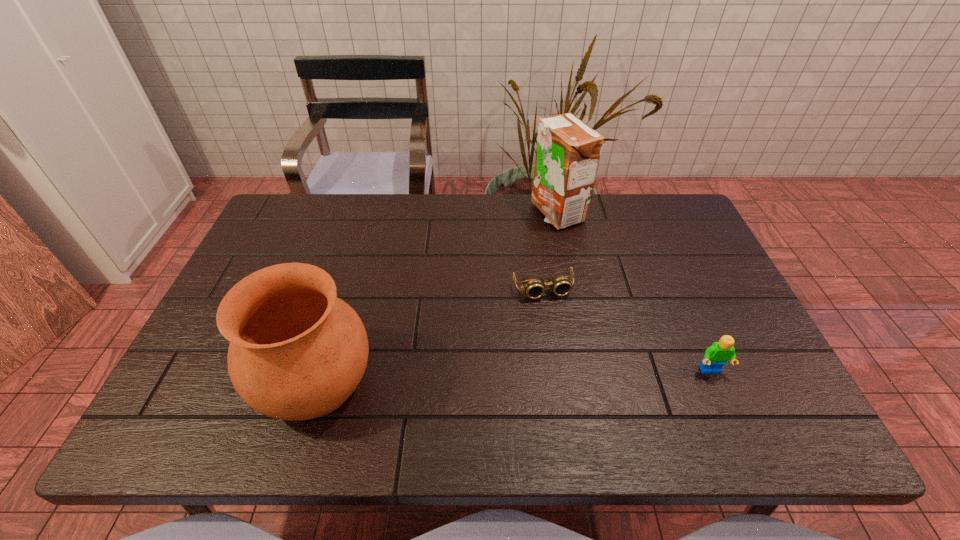
At what (x,y) coordinates should I click in order to perform the action: click on free space that is in between the Lego and the third nearest object. Please return your answer as a coordinate pair (x, y). The width and height of the screenshot is (960, 540). Looking at the image, I should click on (627, 330).

Where is `vacant space that's between the second shortest object and the carton`? Image resolution: width=960 pixels, height=540 pixels. vacant space that's between the second shortest object and the carton is located at coordinates (634, 292).

At what (x,y) coordinates should I click in order to perform the action: click on empty space that is in between the goggles and the farthest object. Please return your answer as a coordinate pair (x, y). The width and height of the screenshot is (960, 540). Looking at the image, I should click on (550, 252).

You are a GUI agent. You are given a task and a screenshot of the screen. Output one action in this format:
    pyautogui.click(x=<x>, y=<y>)
    Task: Click on the object that is the closest to the second shortest object
    The image size is (960, 540).
    Given the screenshot: What is the action you would take?
    pyautogui.click(x=533, y=284)

Image resolution: width=960 pixels, height=540 pixels. What are the coordinates of `object that stands as the second closest to the goggles` in the screenshot? It's located at (717, 355).

The image size is (960, 540). I want to click on free space that satisfies the following two spatial constraints: 1. on the back side of the farthest object; 2. on the left side of the leftmost object, so click(x=367, y=213).

Where is `vacant region that satisfies the following two spatial constraints: 1. on the back side of the goggles; 2. on the left side of the carton`? Image resolution: width=960 pixels, height=540 pixels. vacant region that satisfies the following two spatial constraints: 1. on the back side of the goggles; 2. on the left side of the carton is located at coordinates (532, 213).